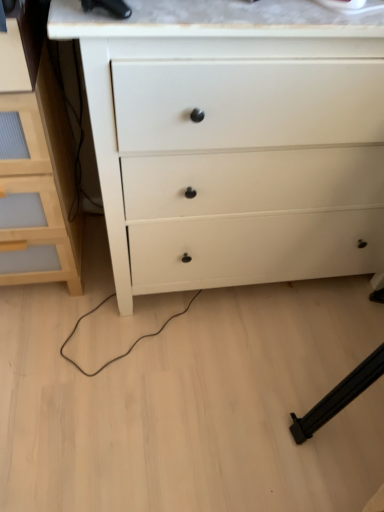
Find the location of a particular element. empty space that is in between light wood chest of drawers at left, which is the 2th chest of drawers from right to left, and white matte chest of drawers at center, the second chest of drawers viewed from the left is located at coordinates (83, 292).